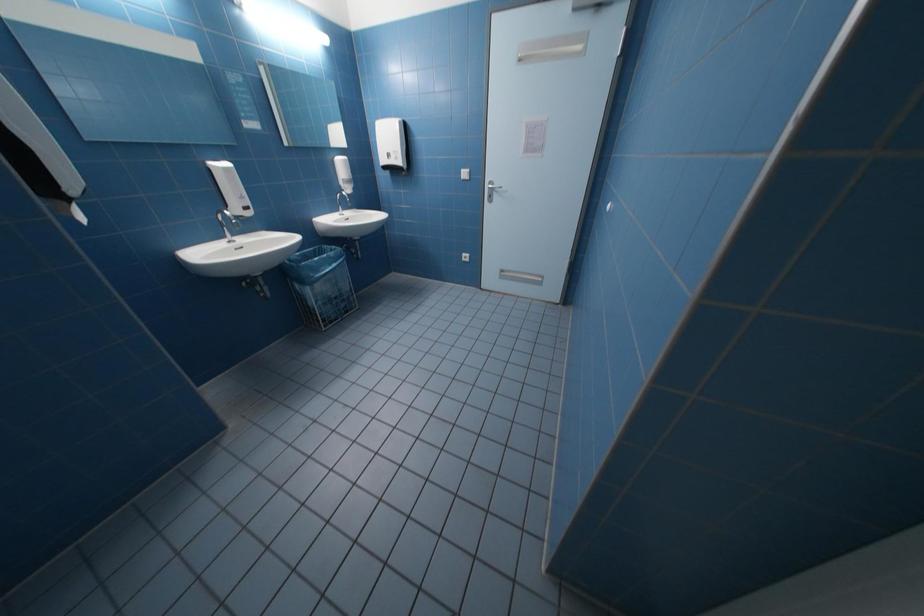
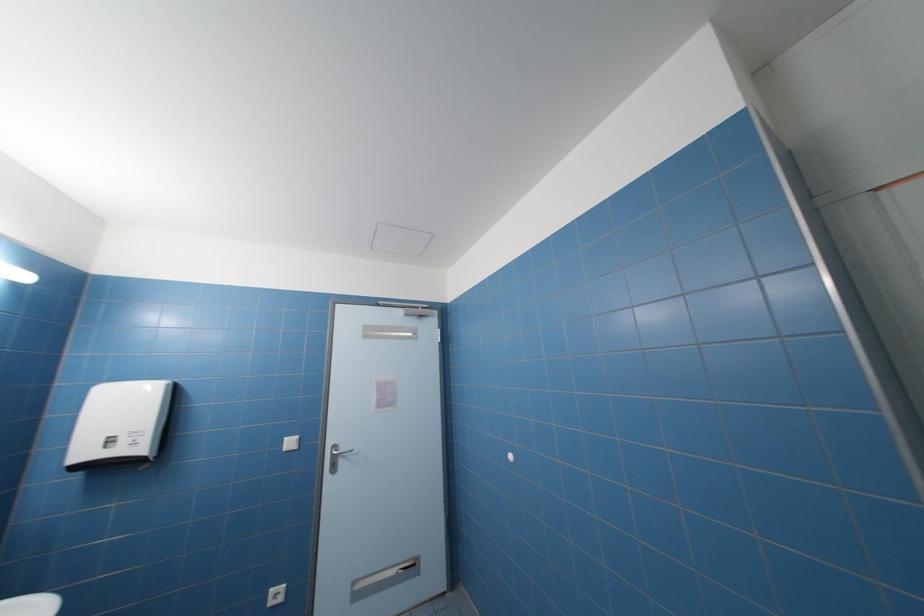
Based on the continuous images, in which direction is the camera rotating?

The rotation direction of the camera is right-up.